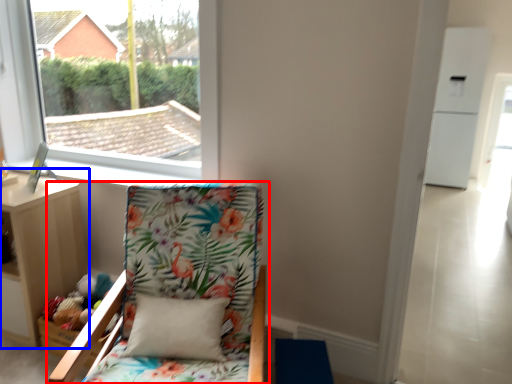
Question: Among these objects, which one is nearest to the camera, chair (highlighted by a red box) or nightstand (highlighted by a blue box)?

Choices:
 (A) chair
 (B) nightstand

Answer: (A)